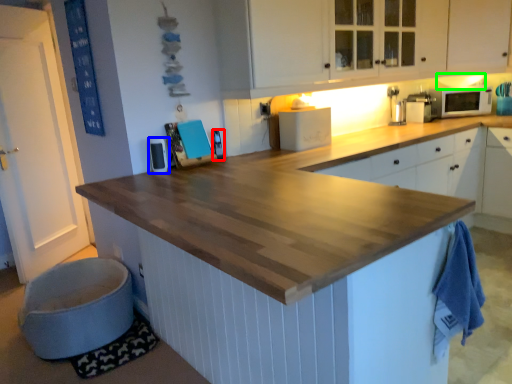
Question: Estimate the real-world distances between objects in this image. Which object is closer to appliance (highlighted by a red box), appliance (highlighted by a blue box) or exhaust hood (highlighted by a green box)?

Choices:
 (A) appliance
 (B) exhaust hood

Answer: (A)